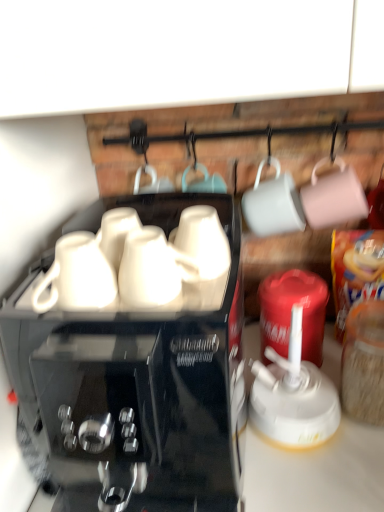
Find the location of a particular element. The height and width of the screenshot is (512, 384). white glossy mug at center, which appears as the first mug when viewed from the left is located at coordinates (148, 269).

The image size is (384, 512). What do you see at coordinates (138, 373) in the screenshot?
I see `black glossy coffee maker at center` at bounding box center [138, 373].

The image size is (384, 512). Find the location of `white glossy mug at center, acting as the 2th mug starting from the left`. white glossy mug at center, acting as the 2th mug starting from the left is located at coordinates (200, 244).

In the image, there is a white glossy mug at center, the first mug in the right-to-left sequence. At what (x,y) coordinates should I click in order to perform the action: click on coffee maker below it (from a real-world perspective). Please return your answer as a coordinate pair (x, y). Looking at the image, I should click on (138, 373).

In the scene shown: Between white glossy mug at center, acting as the 2th mug starting from the left, and black glossy coffee maker at center, which one has larger size?

black glossy coffee maker at center.

From a real-world perspective, who is located higher, white glossy mug at center, the first mug in the right-to-left sequence, or black glossy coffee maker at center?

white glossy mug at center, the first mug in the right-to-left sequence.

Considering the sizes of objects white glossy mug at center, acting as the 2th mug starting from the left, and black glossy coffee maker at center in the image provided, who is taller, white glossy mug at center, acting as the 2th mug starting from the left, or black glossy coffee maker at center?

With more height is black glossy coffee maker at center.

Is white glossy mug at center, which is counted as the second mug, starting from the right, directly adjacent to white glossy mug at center, the first mug in the right-to-left sequence?

Yes, white glossy mug at center, which is counted as the second mug, starting from the right, is touching white glossy mug at center, the first mug in the right-to-left sequence.

How different are the orientations of white glossy mug at center, which is counted as the second mug, starting from the right, and white glossy mug at center, acting as the 2th mug starting from the left, in degrees?

2.89 degrees separate the facing orientations of white glossy mug at center, which is counted as the second mug, starting from the right, and white glossy mug at center, acting as the 2th mug starting from the left.

From the picture: Is white glossy mug at center, which appears as the first mug when viewed from the left, positioned with its back to white glossy mug at center, the first mug in the right-to-left sequence?

No, white glossy mug at center, which appears as the first mug when viewed from the left, is not facing away from white glossy mug at center, the first mug in the right-to-left sequence.

Which point is more distant from viewer, (137, 255) or (208, 234)?

Point (208, 234)

From a real-world perspective, is black glossy coffee maker at center on top of white glossy mug at center, the first mug in the right-to-left sequence?

No, from a real-world perspective, black glossy coffee maker at center is not on top of white glossy mug at center, the first mug in the right-to-left sequence.

Locate an element on the screen. This screenshot has height=512, width=384. the 2nd mug directly above the black glossy coffee maker at center (from a real-world perspective) is located at coordinates (200, 244).

From their relative heights in the image, would you say black glossy coffee maker at center is taller or shorter than white glossy mug at center, acting as the 2th mug starting from the left?

black glossy coffee maker at center is taller than white glossy mug at center, acting as the 2th mug starting from the left.

Considering the positions of objects black glossy coffee maker at center and white glossy mug at center, the first mug in the right-to-left sequence, in the image provided, who is more to the right, black glossy coffee maker at center or white glossy mug at center, the first mug in the right-to-left sequence,?

From the viewer's perspective, white glossy mug at center, the first mug in the right-to-left sequence, appears more on the right side.

From a real-world perspective, is white glossy mug at center, which appears as the first mug when viewed from the left, located beneath black glossy coffee maker at center?

No, from a real-world perspective, white glossy mug at center, which appears as the first mug when viewed from the left, is not under black glossy coffee maker at center.

Between white glossy mug at center, which appears as the first mug when viewed from the left, and black glossy coffee maker at center, which one appears on the left side from the viewer's perspective?

From the viewer's perspective, black glossy coffee maker at center appears more on the left side.

From the image's perspective, between white glossy mug at center, which is counted as the second mug, starting from the right, and black glossy coffee maker at center, which one is located above?

white glossy mug at center, which is counted as the second mug, starting from the right, appears higher in the image.

Who is smaller, white glossy mug at center, which appears as the first mug when viewed from the left, or black glossy coffee maker at center?

white glossy mug at center, which appears as the first mug when viewed from the left, is smaller.

Does black glossy coffee maker at center have a greater width compared to white glossy mug at center, which is counted as the second mug, starting from the right?

Yes, black glossy coffee maker at center is wider than white glossy mug at center, which is counted as the second mug, starting from the right.

Which is further, (170, 318) or (163, 304)?

The point (170, 318) is behind.

Would you say black glossy coffee maker at center is outside white glossy mug at center, which appears as the first mug when viewed from the left?

black glossy coffee maker at center is positioned outside white glossy mug at center, which appears as the first mug when viewed from the left.

Does black glossy coffee maker at center have a larger size compared to white glossy mug at center, which appears as the first mug when viewed from the left?

Correct, black glossy coffee maker at center is larger in size than white glossy mug at center, which appears as the first mug when viewed from the left.

Relative to white glossy mug at center, which is counted as the second mug, starting from the right, is white glossy mug at center, the first mug in the right-to-left sequence, in front or behind?

white glossy mug at center, the first mug in the right-to-left sequence, is positioned farther from the viewer than white glossy mug at center, which is counted as the second mug, starting from the right.

Does white glossy mug at center, acting as the 2th mug starting from the left, have a lesser height compared to white glossy mug at center, which is counted as the second mug, starting from the right?

Incorrect, the height of white glossy mug at center, acting as the 2th mug starting from the left, does not fall short of that of white glossy mug at center, which is counted as the second mug, starting from the right.

Considering the relative positions of white glossy mug at center, the first mug in the right-to-left sequence, and white glossy mug at center, which is counted as the second mug, starting from the right, in the image provided, is white glossy mug at center, the first mug in the right-to-left sequence, to the right of white glossy mug at center, which is counted as the second mug, starting from the right, from the viewer's perspective?

Indeed, white glossy mug at center, the first mug in the right-to-left sequence, is positioned on the right side of white glossy mug at center, which is counted as the second mug, starting from the right.

Would you consider white glossy mug at center, the first mug in the right-to-left sequence, to be distant from white glossy mug at center, which appears as the first mug when viewed from the left?

No, white glossy mug at center, the first mug in the right-to-left sequence, is not far from white glossy mug at center, which appears as the first mug when viewed from the left.

From the image's perspective, which mug is the 2nd one above the black glossy coffee maker at center? Please provide its 2D coordinates.

[(200, 244)]

This screenshot has width=384, height=512. Find the location of `mug in front of the white glossy mug at center, the first mug in the right-to-left sequence`. mug in front of the white glossy mug at center, the first mug in the right-to-left sequence is located at coordinates (148, 269).

Looking at the image, which one is located closer to black glossy coffee maker at center, white glossy mug at center, which appears as the first mug when viewed from the left, or white glossy mug at center, acting as the 2th mug starting from the left?

white glossy mug at center, which appears as the first mug when viewed from the left.

From the image, which object appears to be farther from white glossy mug at center, which is counted as the second mug, starting from the right, white glossy mug at center, acting as the 2th mug starting from the left, or black glossy coffee maker at center?

Among the two, black glossy coffee maker at center is located further to white glossy mug at center, which is counted as the second mug, starting from the right.

Which object lies further to the anchor point white glossy mug at center, the first mug in the right-to-left sequence, black glossy coffee maker at center or white glossy mug at center, which appears as the first mug when viewed from the left?

black glossy coffee maker at center is further to white glossy mug at center, the first mug in the right-to-left sequence.

Considering their positions, is white glossy mug at center, which appears as the first mug when viewed from the left, positioned closer to white glossy mug at center, the first mug in the right-to-left sequence, than black glossy coffee maker at center?

white glossy mug at center, which appears as the first mug when viewed from the left.

Looking at the image, which one is located further to black glossy coffee maker at center, white glossy mug at center, acting as the 2th mug starting from the left, or white glossy mug at center, which appears as the first mug when viewed from the left?

white glossy mug at center, acting as the 2th mug starting from the left, is further to black glossy coffee maker at center.

When comparing their distances from white glossy mug at center, which is counted as the second mug, starting from the right, does black glossy coffee maker at center or white glossy mug at center, acting as the 2th mug starting from the left, seem further?

black glossy coffee maker at center.

Find the location of `mug positioned between black glossy coffee maker at center and white glossy mug at center, the first mug in the right-to-left sequence, from near to far`. mug positioned between black glossy coffee maker at center and white glossy mug at center, the first mug in the right-to-left sequence, from near to far is located at coordinates (148, 269).